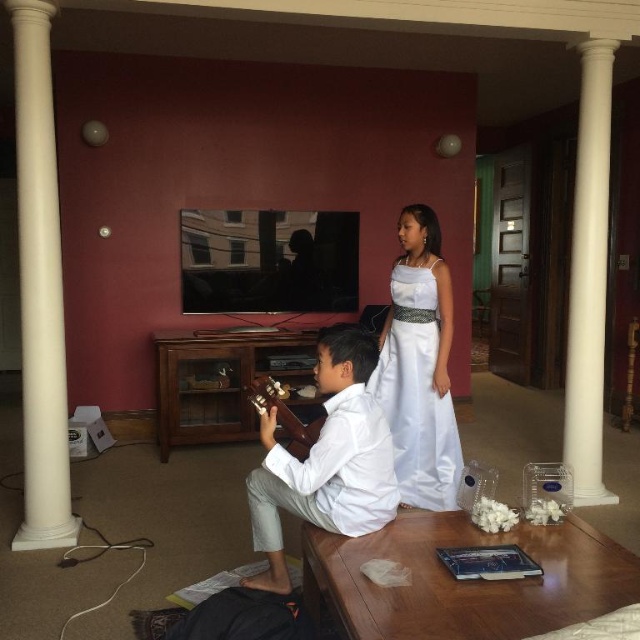
Does white smooth column at right lie behind brown wooden guitar at center?

Yes, it is behind brown wooden guitar at center.

Measure the distance between white smooth column at right and brown wooden guitar at center.

A distance of 1.75 meters exists between white smooth column at right and brown wooden guitar at center.

Is point (596, 349) closer to viewer compared to point (305, 444)?

No, it is not.

This screenshot has width=640, height=640. I want to click on white smooth column at right, so click(588, 276).

Between point (45, 314) and point (314, 436), which one is positioned in front?

Positioned in front is point (314, 436).

Between point (33, 320) and point (323, 416), which one is positioned in front?

Point (33, 320) is more forward.

Locate an element on the screen. The height and width of the screenshot is (640, 640). white smooth column at left is located at coordinates (38, 289).

Which is more to the left, white matte shirt at center or brown wooden guitar at center?

brown wooden guitar at center

Between white matte shirt at center and brown wooden guitar at center, which one is positioned lower?

white matte shirt at center

Is point (307, 486) in front of point (253, 381)?

Yes, it is in front of point (253, 381).

Identify the location of white matte shirt at center. (326, 460).